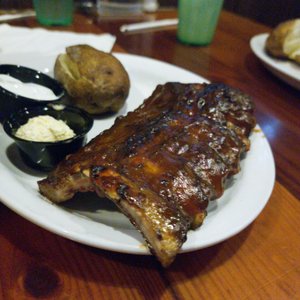
Locate an element on the screen. This screenshot has height=300, width=300. lighter wood panel is located at coordinates (248, 252).